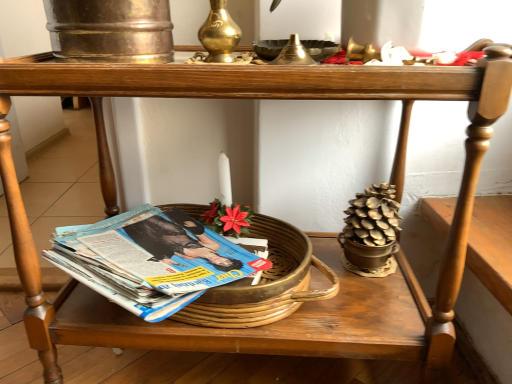
Question: Is blue glossy magazine at lower left facing towards wooden table at lower center?

Choices:
 (A) yes
 (B) no

Answer: (B)

Question: Can you confirm if blue glossy magazine at lower left is wider than wooden table at lower center?

Choices:
 (A) no
 (B) yes

Answer: (A)

Question: Can wooden table at lower center be found inside blue glossy magazine at lower left?

Choices:
 (A) no
 (B) yes

Answer: (A)

Question: Can you confirm if blue glossy magazine at lower left is positioned to the left of wooden table at lower center?

Choices:
 (A) yes
 (B) no

Answer: (A)

Question: From a real-world perspective, is blue glossy magazine at lower left positioned under wooden table at lower center based on gravity?

Choices:
 (A) yes
 (B) no

Answer: (B)

Question: From the image's perspective, is blue glossy magazine at lower left above wooden table at lower center?

Choices:
 (A) yes
 (B) no

Answer: (A)

Question: Does blue glossy magazine at lower left have a smaller size compared to brass candle holder at upper center, positioned as the 2th candle holder in right-to-left order?

Choices:
 (A) no
 (B) yes

Answer: (A)

Question: Is blue glossy magazine at lower left further to camera compared to brass candle holder at upper center, placed as the 1th candle holder when sorted from left to right?

Choices:
 (A) yes
 (B) no

Answer: (A)

Question: Is blue glossy magazine at lower left looking in the opposite direction of brass candle holder at upper center, positioned as the 2th candle holder in right-to-left order?

Choices:
 (A) no
 (B) yes

Answer: (A)

Question: Does blue glossy magazine at lower left touch brass candle holder at upper center, placed as the 1th candle holder when sorted from left to right?

Choices:
 (A) yes
 (B) no

Answer: (B)

Question: From a real-world perspective, is blue glossy magazine at lower left on brass candle holder at upper center, placed as the 1th candle holder when sorted from left to right?

Choices:
 (A) no
 (B) yes

Answer: (A)

Question: Is blue glossy magazine at lower left not within brass candle holder at upper center, positioned as the 2th candle holder in right-to-left order?

Choices:
 (A) yes
 (B) no

Answer: (A)

Question: Does gold metallic candle holder at upper center, the second candle holder in the left-to-right sequence, contain metallic gold bowl at upper center?

Choices:
 (A) yes
 (B) no

Answer: (B)